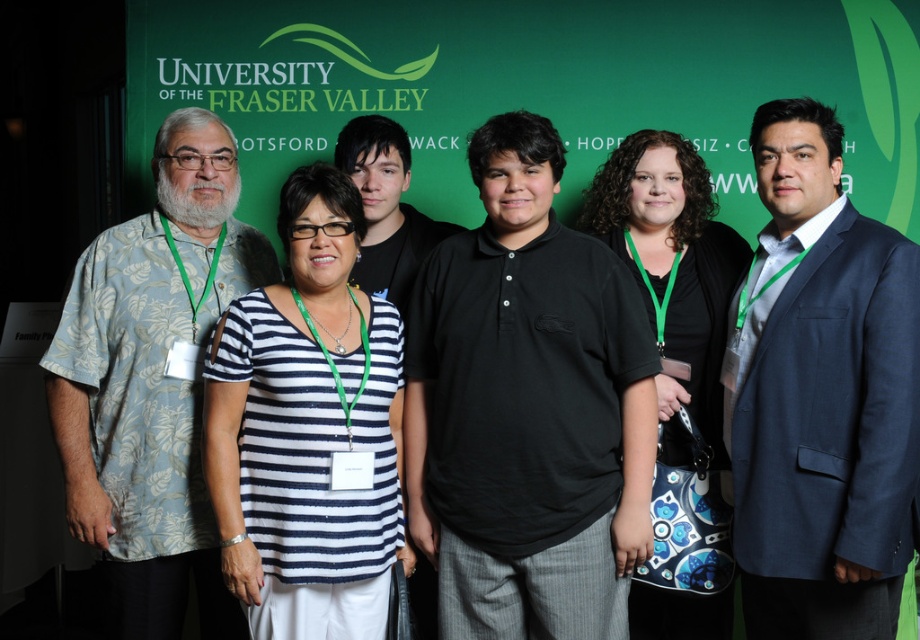
Question: Estimate the real-world distances between objects in this image. Which object is closer to the black cotton polo shirt at center?

Choices:
 (A) light blue floral shirt at left
 (B) navy blue suit at center
 (C) black cotton shirt at center

Answer: (B)

Question: Is light blue floral shirt at left below black cotton shirt at center?

Choices:
 (A) no
 (B) yes

Answer: (B)

Question: Which of the following is the farthest from the observer?

Choices:
 (A) black cotton shirt at center
 (B) white striped shirt at center

Answer: (A)

Question: Is navy blue suit at center closer to camera compared to black cotton shirt at center?

Choices:
 (A) no
 (B) yes

Answer: (B)

Question: Does navy blue suit at center appear under light blue floral shirt at left?

Choices:
 (A) yes
 (B) no

Answer: (B)

Question: Which object is closer to the camera taking this photo?

Choices:
 (A) light blue floral shirt at left
 (B) black cotton polo shirt at center
 (C) black cotton shirt at center
 (D) navy blue suit at center

Answer: (D)